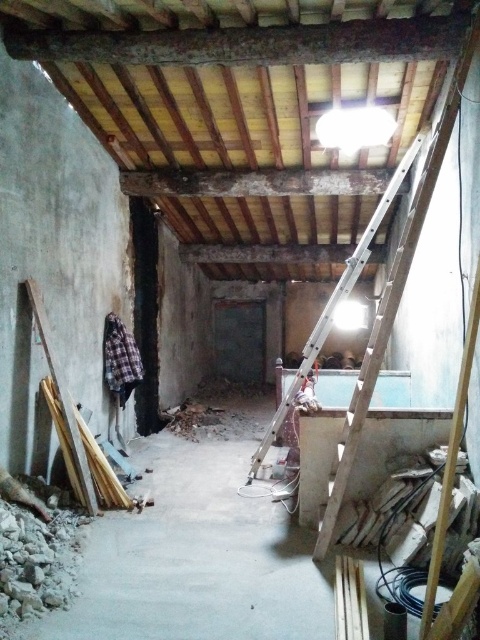
Looking at this image, you are a worker in the room and need to place a heavy tool box on a surface. Which object between the concrete floor at center and the wooden ladder at upper right would be more stable for placing the tool box?

The concrete floor at center has a lesser height compared to wooden ladder at upper right, so placing the tool box on the concrete floor at center would be more stable since it is lower to the ground and less likely to tip over.

You are a worker in the construction site. You need to move a heavy tool from the concrete floor at center to the wooden ladder at upper right. Which object has a larger surface area for placing the tool?

The wooden ladder at upper right has a larger surface area compared to the concrete floor at center, so it can accommodate the heavy tool more securely.